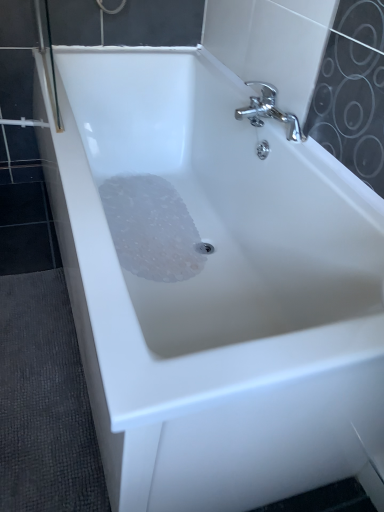
What do you see at coordinates (152, 228) in the screenshot? The width and height of the screenshot is (384, 512). I see `translucent rubber mat at center` at bounding box center [152, 228].

Locate an element on the screen. The image size is (384, 512). translucent rubber mat at center is located at coordinates (152, 228).

Locate an element on the screen. translucent rubber mat at center is located at coordinates (152, 228).